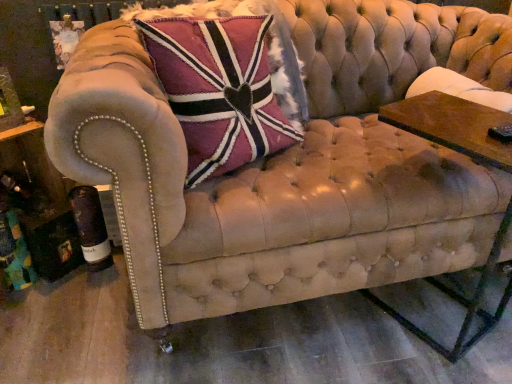
Identify the location of free space in front of wooden rectangular table at right. (437, 360).